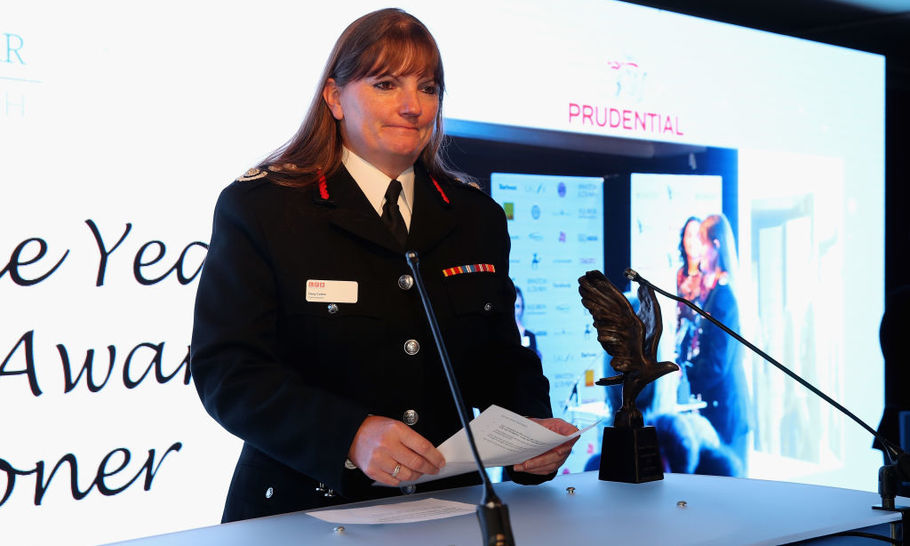
The height and width of the screenshot is (546, 910). I want to click on sign above doorway that says prudential in red lettering, so click(688, 123).